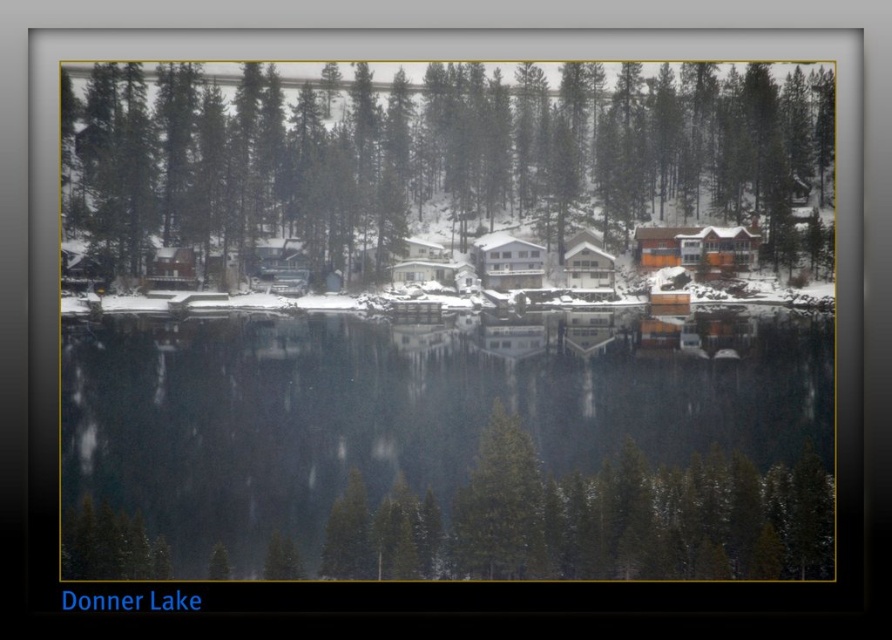
You are an architect designing a new eco friendly house that needs to be placed between the clear water at center and the green matte trees at center. Based on their heights, which object should the house be closer to?

The clear water at center has a lesser height compared to the green matte trees at center. Therefore, the house should be closer to the clear water at center to ensure proper visibility and structural stability.

You are standing at the lakeside and want to take a photo of the clear water at center and the green matte trees at center. Which object will appear closer to the camera in the photo?

The clear water at center will appear closer to the camera because it is in front of the green matte trees at center.